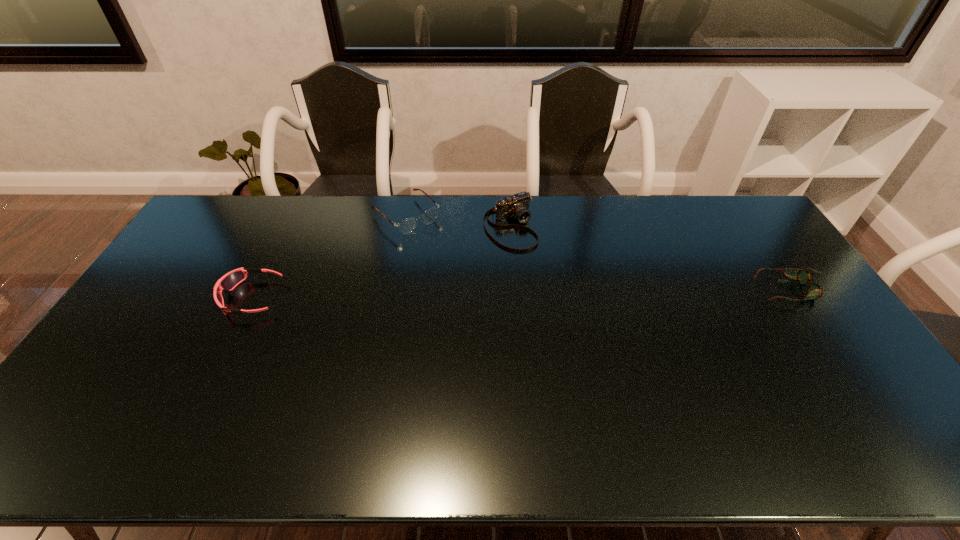
Identify the location of free space on the desktop that is between the goggles and the rightmost object and is positioned on the front-facing side of the camera. (567, 293).

Where is `vacant spot on the desktop that is between the goggles and the shorter spectacles and is positioned on the front-facing side of the second object from left to right`? This screenshot has height=540, width=960. vacant spot on the desktop that is between the goggles and the shorter spectacles and is positioned on the front-facing side of the second object from left to right is located at coordinates (492, 294).